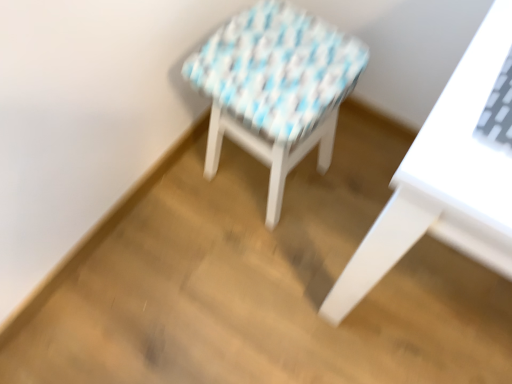
Where is `vacant area situated to the left side of white woven stool at center`? vacant area situated to the left side of white woven stool at center is located at coordinates (176, 205).